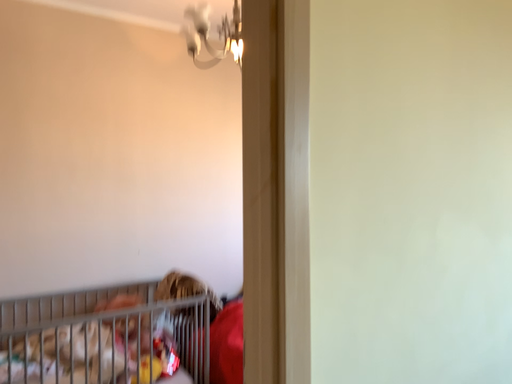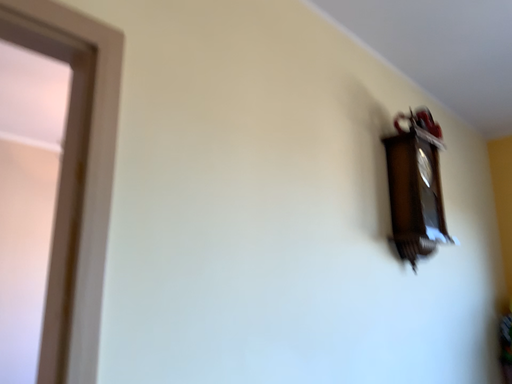
Question: How did the camera likely rotate when shooting the video?

Choices:
 (A) rotated left
 (B) rotated right

Answer: (B)